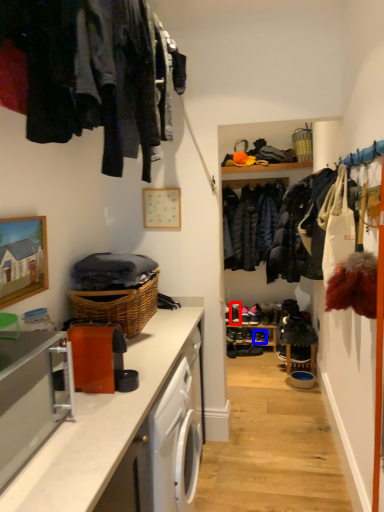
Question: Which of the following is the farthest to the observer, shoe (highlighted by a red box) or shoe (highlighted by a blue box)?

Choices:
 (A) shoe
 (B) shoe

Answer: (A)